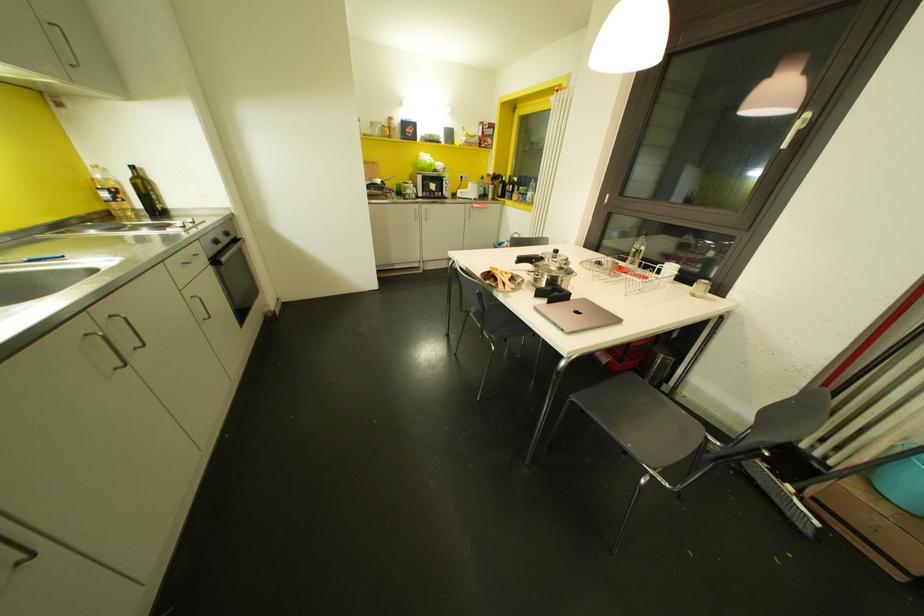
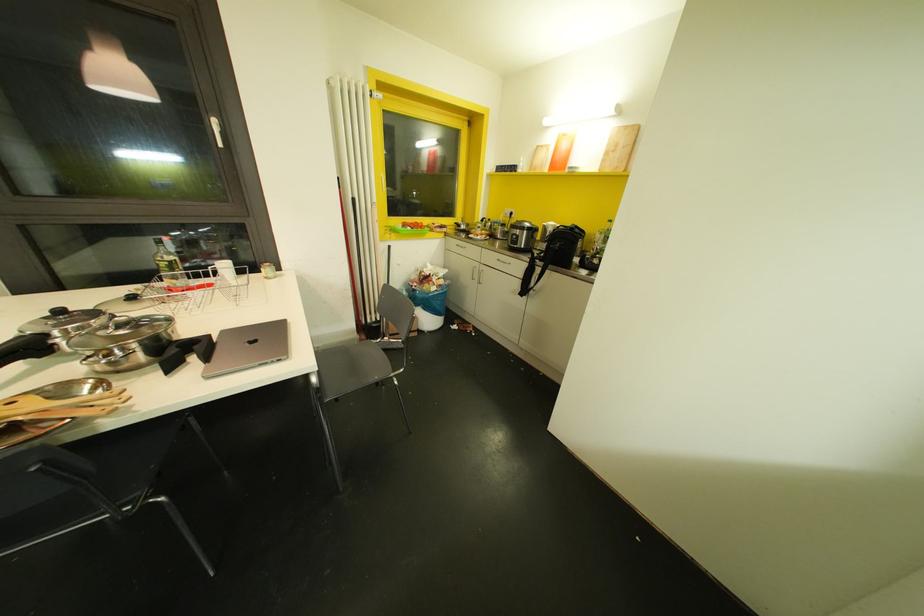
The point at (584,299) is marked in the first image. Where is the corresponding point in the second image?

(223, 331)